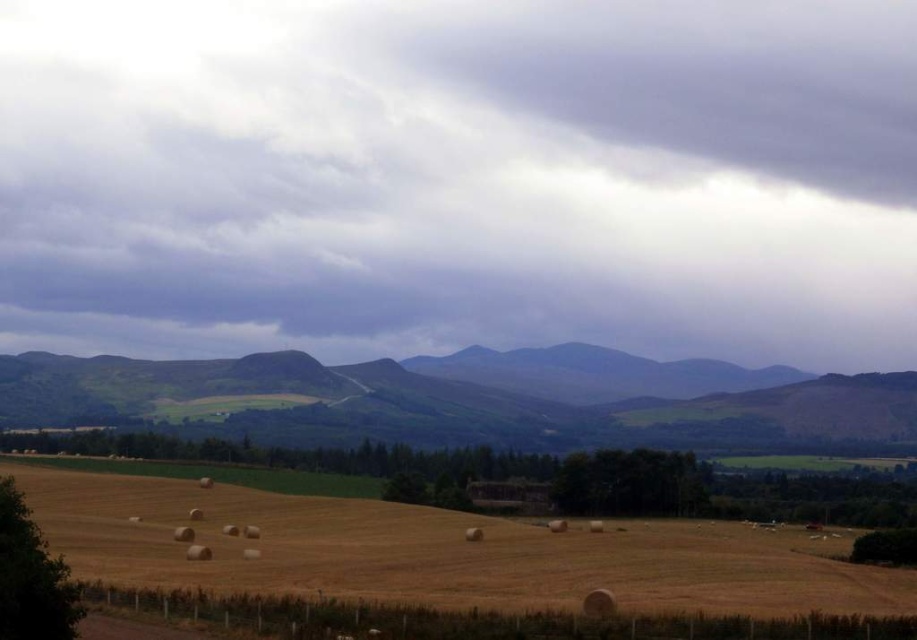
Is point (868, 19) farther from camera compared to point (19, 387)?

Yes.

This screenshot has height=640, width=917. In order to click on gray cloudy sky at upper center in this screenshot , I will do `click(460, 177)`.

Does yellow straw bales at lower center lie in front of green grassy hill at center?

Yes, yellow straw bales at lower center is closer to the viewer.

Does point (358, 544) come behind point (473, 412)?

No, it is not.

Locate an element on the screen. yellow straw bales at lower center is located at coordinates (443, 552).

Between gray cloudy sky at upper center and yellow straw bales at lower center, which one is positioned higher?

gray cloudy sky at upper center

Is point (376, 230) closer to camera compared to point (231, 561)?

No, (376, 230) is behind (231, 561).

Where is `gray cloudy sky at upper center`? gray cloudy sky at upper center is located at coordinates (460, 177).